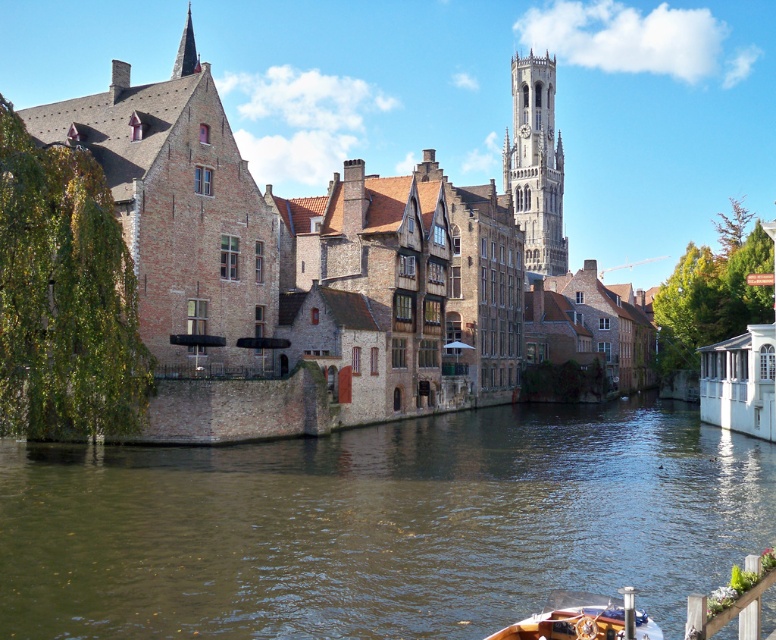
Question: From the image, what is the correct spatial relationship of brown water at center in relation to stone clock tower at upper right?

Choices:
 (A) below
 (B) above

Answer: (A)

Question: Considering the real-world distances, which object is closest to the brown water at center?

Choices:
 (A) stone clock tower at upper right
 (B) wooden polished boat at lower center

Answer: (B)

Question: Considering the real-world distances, which object is farthest from the wooden polished boat at lower center?

Choices:
 (A) stone clock tower at upper right
 (B) brown water at center

Answer: (A)

Question: Does brown water at center appear on the left side of wooden polished boat at lower center?

Choices:
 (A) yes
 (B) no

Answer: (A)

Question: Does stone clock tower at upper right have a smaller size compared to wooden polished boat at lower center?

Choices:
 (A) yes
 (B) no

Answer: (B)

Question: Which point appears farthest from the camera in this image?

Choices:
 (A) (570, 547)
 (B) (539, 67)

Answer: (B)